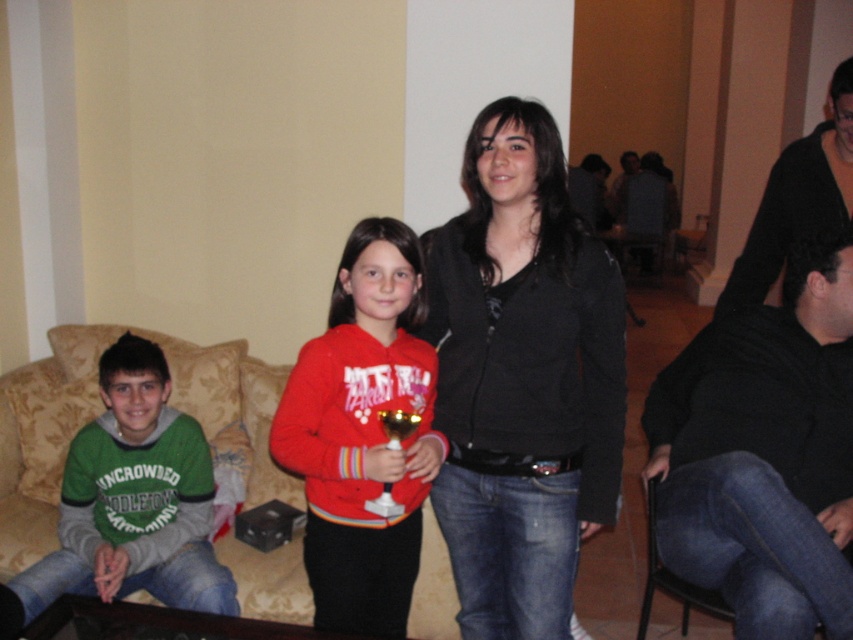
Does point (479, 433) lie in front of point (303, 541)?

That is True.

Is black matte jacket at center to the right of matte red hoodie at center from the viewer's perspective?

Indeed, black matte jacket at center is positioned on the right side of matte red hoodie at center.

At what (x,y) coordinates should I click in order to perform the action: click on black matte jacket at center. Please return your answer as a coordinate pair (x, y). The width and height of the screenshot is (853, 640). Looking at the image, I should click on (521, 378).

Which is in front, point (190, 573) or point (387, 429)?

Point (387, 429)

Is green fleece sweatshirt at left bigger than gold metallic trophy at center?

Yes.

What do you see at coordinates (134, 499) in the screenshot? I see `green fleece sweatshirt at left` at bounding box center [134, 499].

The width and height of the screenshot is (853, 640). What are the coordinates of `green fleece sweatshirt at left` in the screenshot? It's located at (134, 499).

Is point (514, 113) closer to camera compared to point (122, 474)?

Yes, it is.

From the picture: Does black matte jacket at center appear on the left side of green fleece sweatshirt at left?

In fact, black matte jacket at center is to the right of green fleece sweatshirt at left.

Between point (531, 268) and point (73, 502), which one is positioned behind?

The point (73, 502) is more distant.

The height and width of the screenshot is (640, 853). Identify the location of black matte jacket at center. (521, 378).